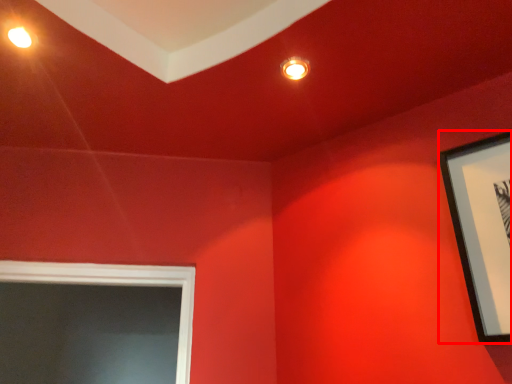
Question: From the image's perspective, what is the correct spatial relationship of picture frame (annotated by the red box) in relation to lighting?

Choices:
 (A) below
 (B) above

Answer: (A)